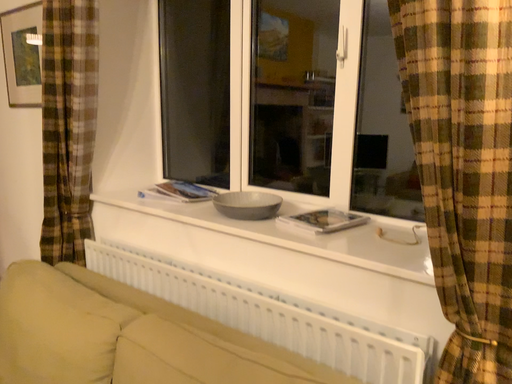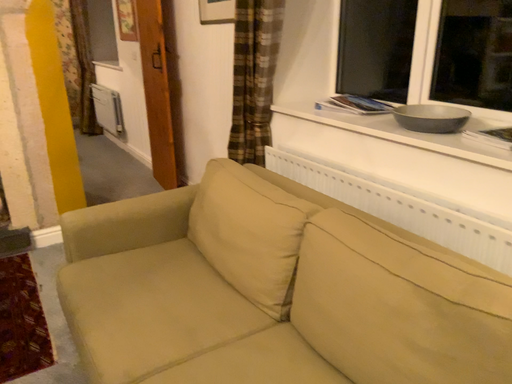
Question: Which way did the camera rotate in the video?

Choices:
 (A) rotated downward
 (B) rotated upward

Answer: (A)